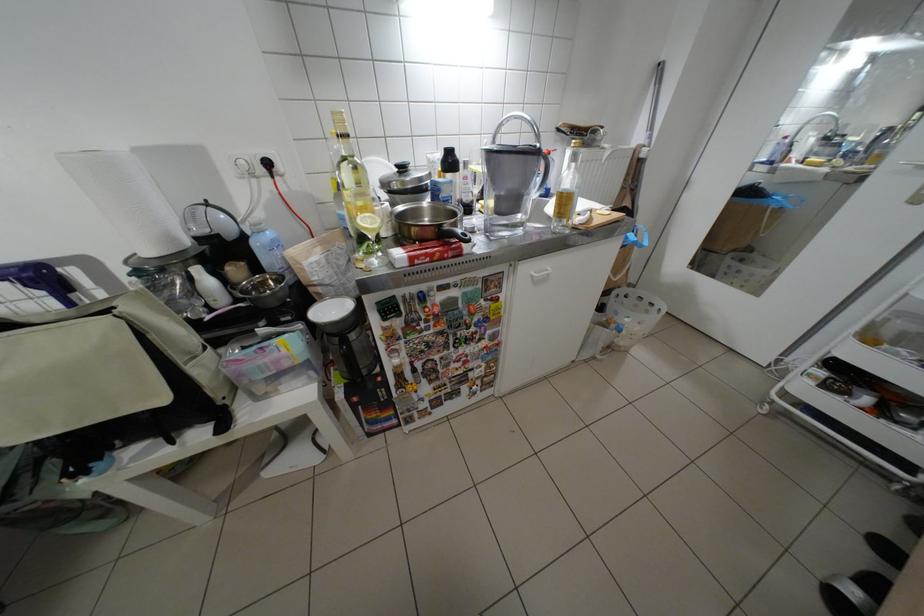
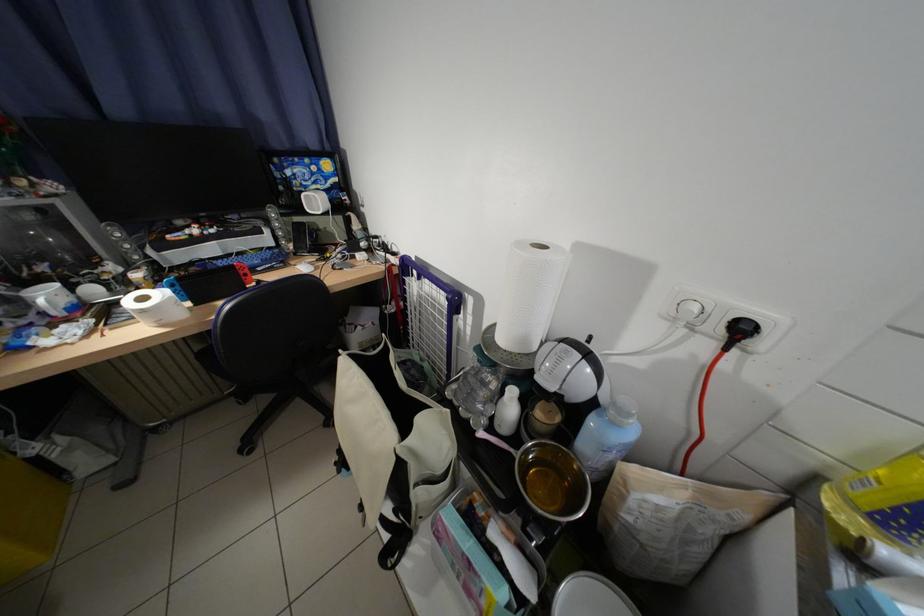
Where in the second image is the point corresponding to the point at 280,166 from the first image?

(754, 331)